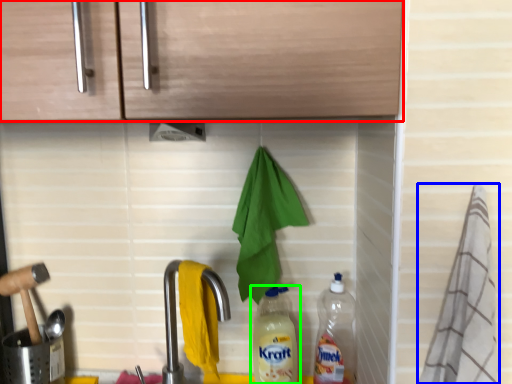
Question: Which is nearer to the cabinetry (highlighted by a red box)? material (highlighted by a blue box) or bottle (highlighted by a green box).

Choices:
 (A) material
 (B) bottle

Answer: (A)